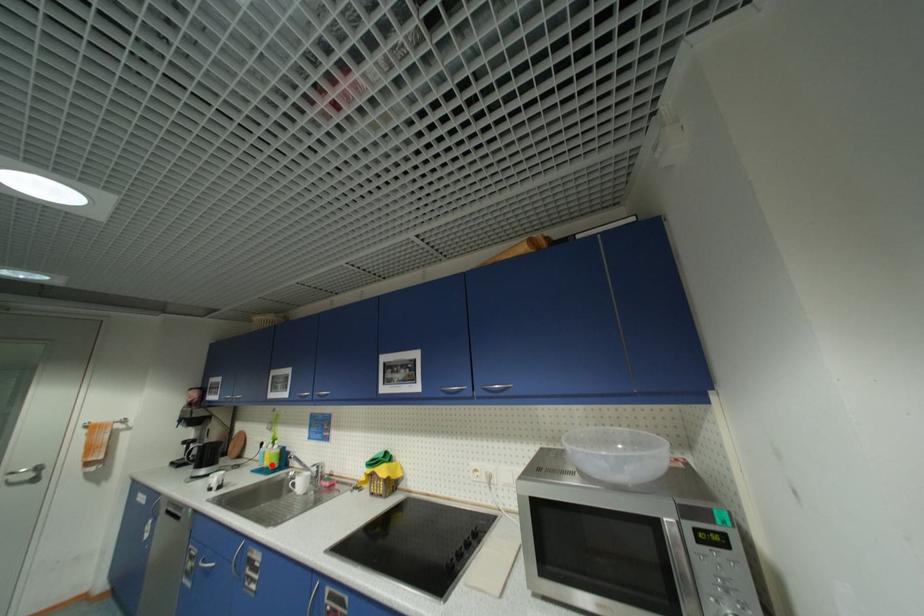
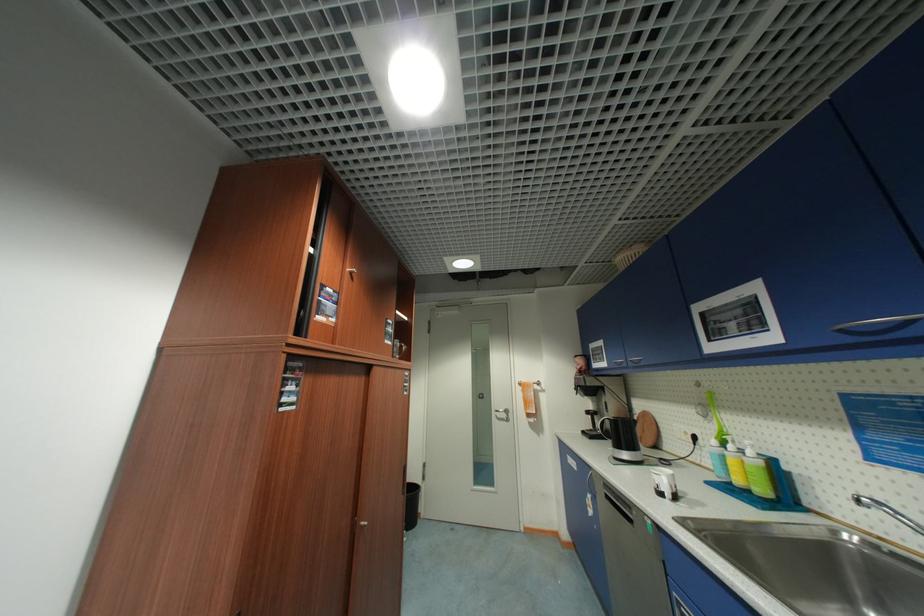
Locate, in the second image, the point that corresponds to the highlighted location in the first image.

(744, 482)